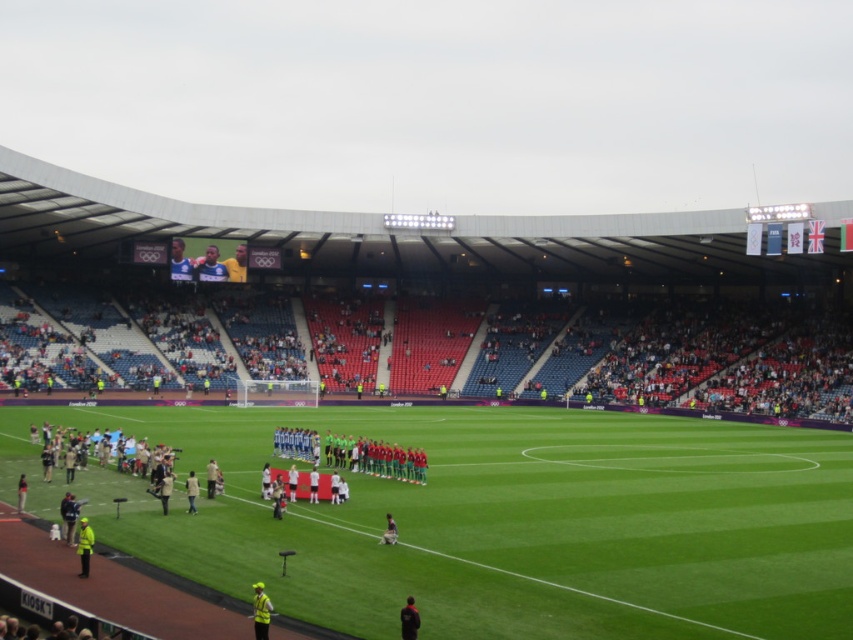
You are a photographer standing at the center of the soccer field during the national anthem. You want to take a photo that includes both the point at coordinates point (x=688, y=545) and point (x=225, y=260). Which point should you focus on first to ensure both are in focus?

You should focus on point (x=688, y=545) first because it is closer to the camera than point (x=225, y=260), so adjusting focus from near to far will help both points be in focus.

You are a photographer positioned at the front of the stadium. You want to capture a photo of the white jersey at center without the smooth blue shirt at upper left blocking it. What should you do?

The white jersey at center is behind the smooth blue shirt at upper left, so you should move to a position in front of the smooth blue shirt at upper left to ensure the white jersey at center is visible without obstruction.